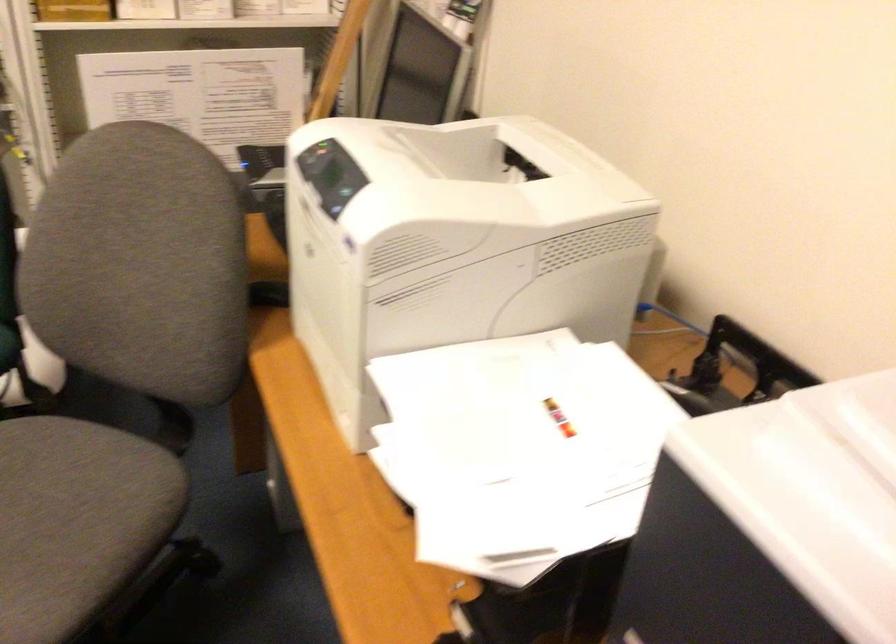
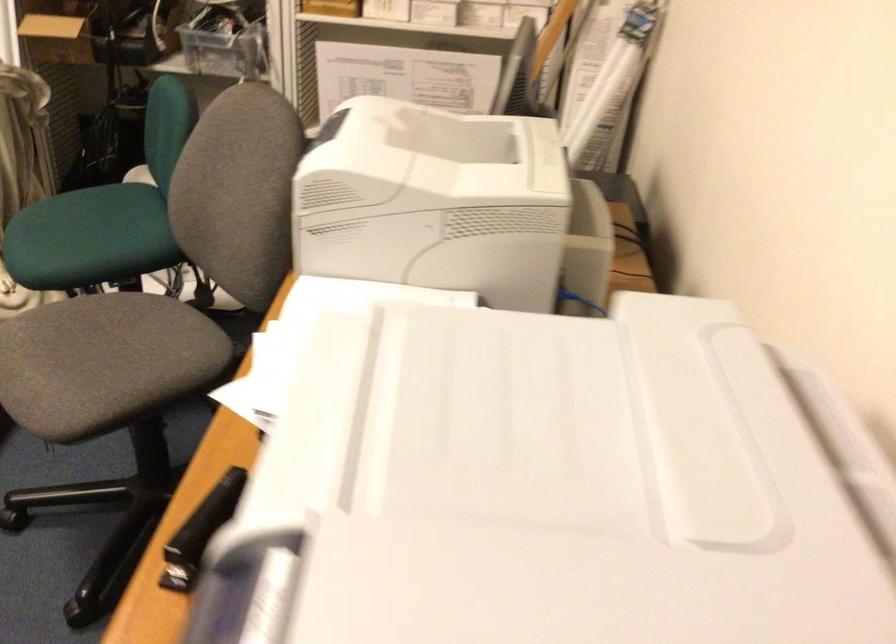
Question: The first image is from the beginning of the video and the second image is from the end. How did the camera likely rotate when shooting the video?

Choices:
 (A) Left
 (B) Right
 (C) Up
 (D) Down

Answer: (A)